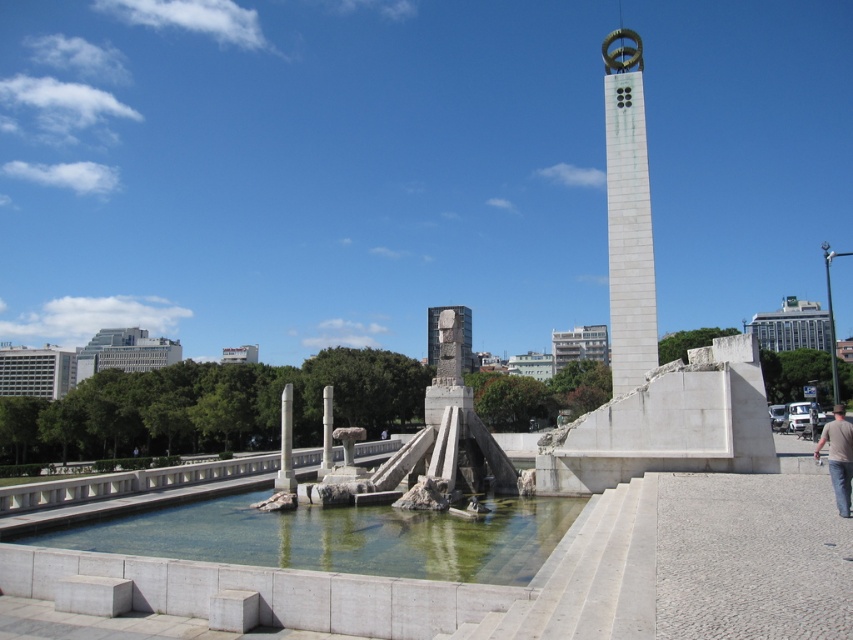
Which is above, clear glass water at center or white marble bell tower at upper center?

Positioned higher is white marble bell tower at upper center.

Between point (494, 524) and point (610, 147), which one is positioned in front?

Point (494, 524)

Between point (344, 528) and point (641, 378), which one is positioned in front?

Point (344, 528) is more forward.

Locate an element on the screen. The height and width of the screenshot is (640, 853). clear glass water at center is located at coordinates (340, 538).

Does white marble bell tower at upper center have a lesser height compared to brown cotton shirt at lower right?

No.

Is point (640, 40) less distant than point (837, 445)?

No, (640, 40) is behind (837, 445).

Identify the location of white marble bell tower at upper center. (628, 214).

Locate an element on the screen. The width and height of the screenshot is (853, 640). white marble bell tower at upper center is located at coordinates (628, 214).

Is clear glass water at center above brown cotton shirt at lower right?

Actually, clear glass water at center is below brown cotton shirt at lower right.

What do you see at coordinates (340, 538) in the screenshot?
I see `clear glass water at center` at bounding box center [340, 538].

Which is behind, point (247, 512) or point (842, 410)?

The point (247, 512) is behind.

You are a GUI agent. You are given a task and a screenshot of the screen. Output one action in this format:
    pyautogui.click(x=<x>, y=<y>)
    Task: Click on the clear glass water at center
    This screenshot has width=853, height=640.
    Given the screenshot: What is the action you would take?
    pyautogui.click(x=340, y=538)